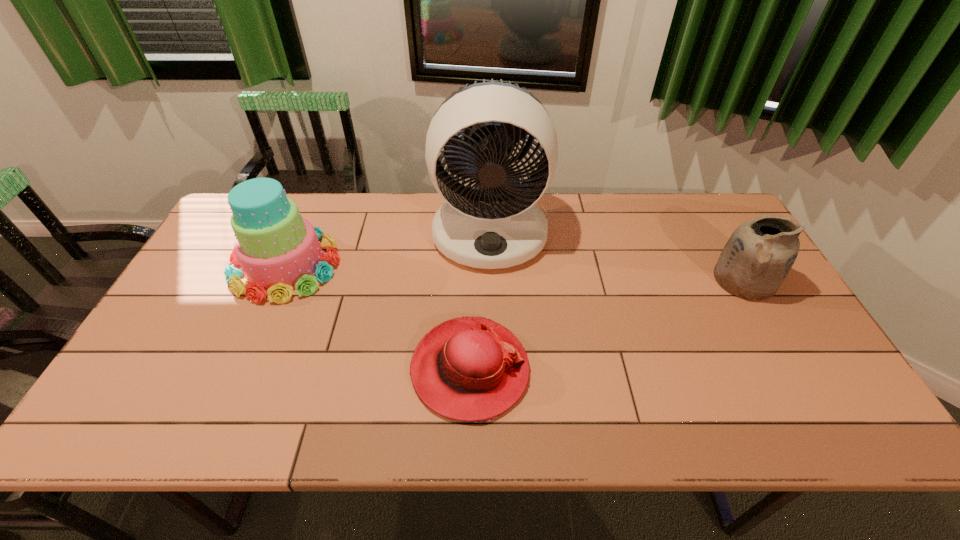
This screenshot has height=540, width=960. Identify the location of vacant space at the right edge of the desktop. (741, 327).

This screenshot has height=540, width=960. In the image, there is a desktop. Find the location of `vacant space at the far right corner`. vacant space at the far right corner is located at coordinates (708, 231).

The image size is (960, 540). What are the coordinates of `free space that is in between the shortest object and the fan` in the screenshot? It's located at (480, 301).

Locate an element on the screen. The height and width of the screenshot is (540, 960). free space between the cake and the fan is located at coordinates (388, 249).

Where is `free spot between the nearest object and the pottery`? The height and width of the screenshot is (540, 960). free spot between the nearest object and the pottery is located at coordinates (607, 325).

The height and width of the screenshot is (540, 960). Identify the location of vacant space that is in between the third shortest object and the hat. (377, 318).

The width and height of the screenshot is (960, 540). Identify the location of empty space that is in between the rightmost object and the nearest object. (607, 325).

You are a GUI agent. You are given a task and a screenshot of the screen. Output one action in this format:
    pyautogui.click(x=<x>, y=<y>)
    Task: Click on the free area in between the shortest object and the pottery
    The width and height of the screenshot is (960, 540).
    Given the screenshot: What is the action you would take?
    pyautogui.click(x=607, y=325)

Locate an element on the screen. The height and width of the screenshot is (540, 960). vacant area that lies between the nearest object and the tallest object is located at coordinates (480, 301).

I want to click on blank region between the leftmost object and the fan, so click(x=388, y=249).